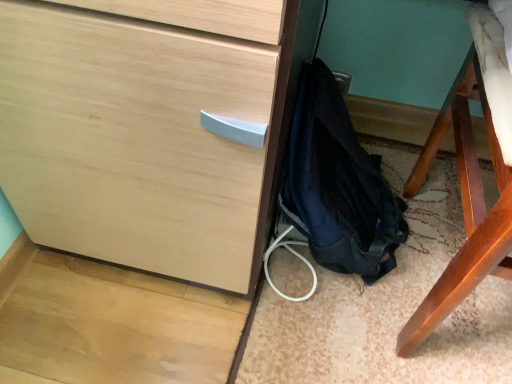
Question: Is matte wood chest of drawers at center bigger or smaller than dark blue fabric backpack at lower right?

Choices:
 (A) big
 (B) small

Answer: (A)

Question: Is matte wood chest of drawers at center to the left or to the right of dark blue fabric backpack at lower right in the image?

Choices:
 (A) right
 (B) left

Answer: (A)

Question: Does point (305, 14) appear closer or farther from the camera than point (304, 153)?

Choices:
 (A) closer
 (B) farther

Answer: (B)

Question: Would you say dark blue fabric backpack at lower right is to the left or to the right of matte wood chest of drawers at center in the picture?

Choices:
 (A) right
 (B) left

Answer: (B)

Question: Is dark blue fabric backpack at lower right inside or outside of matte wood chest of drawers at center?

Choices:
 (A) outside
 (B) inside

Answer: (B)

Question: Looking at their shapes, would you say dark blue fabric backpack at lower right is wider or thinner than matte wood chest of drawers at center?

Choices:
 (A) wide
 (B) thin

Answer: (B)

Question: From the image's perspective, is dark blue fabric backpack at lower right above or below matte wood chest of drawers at center?

Choices:
 (A) above
 (B) below

Answer: (B)